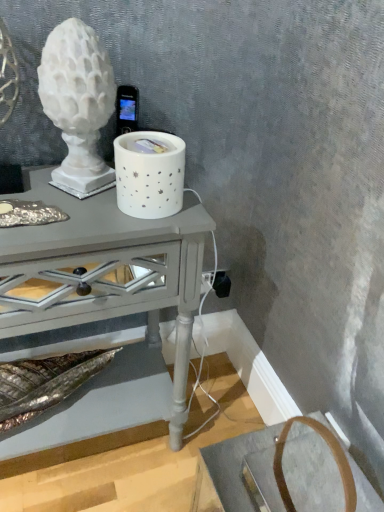
Image resolution: width=384 pixels, height=512 pixels. In order to click on free space above matte gray table at center (from a real-world perspective) in this screenshot , I will do `click(62, 205)`.